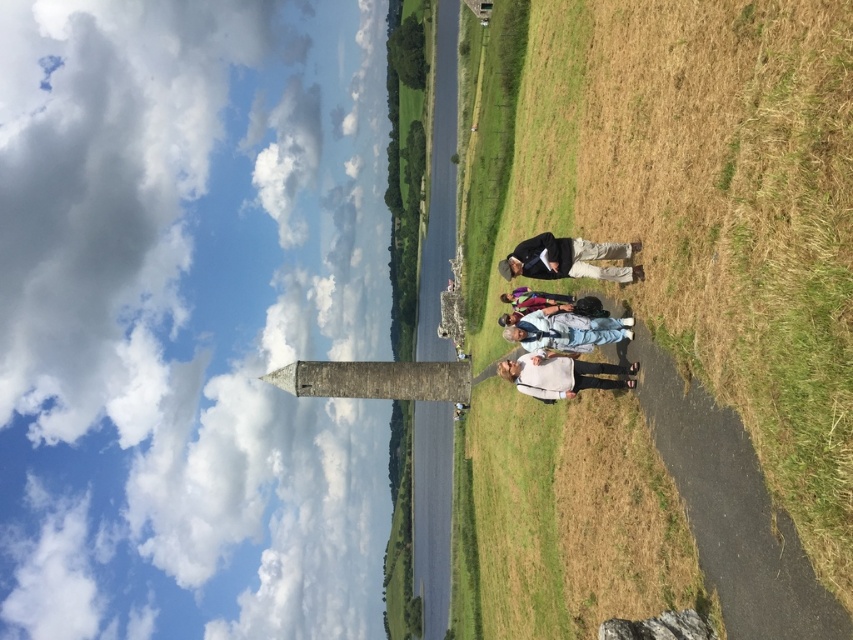
You are a photographer trying to capture a photo of the group of people walking away from you. You notice two individuals wearing a dark gray jacket at center and a matte purple shirt at center. Which clothing item should you focus on to ensure it appears larger in the photo?

The dark gray jacket at center is bigger than the matte purple shirt at center, so focusing on the dark gray jacket at center will ensure it appears larger in the photo.

You are standing at the center of the paved path and want to reach the dry grass at center. Which direction should you walk to get there?

The dry grass at center is located at point coordinates, so you should walk towards the center of the paved path to reach it.